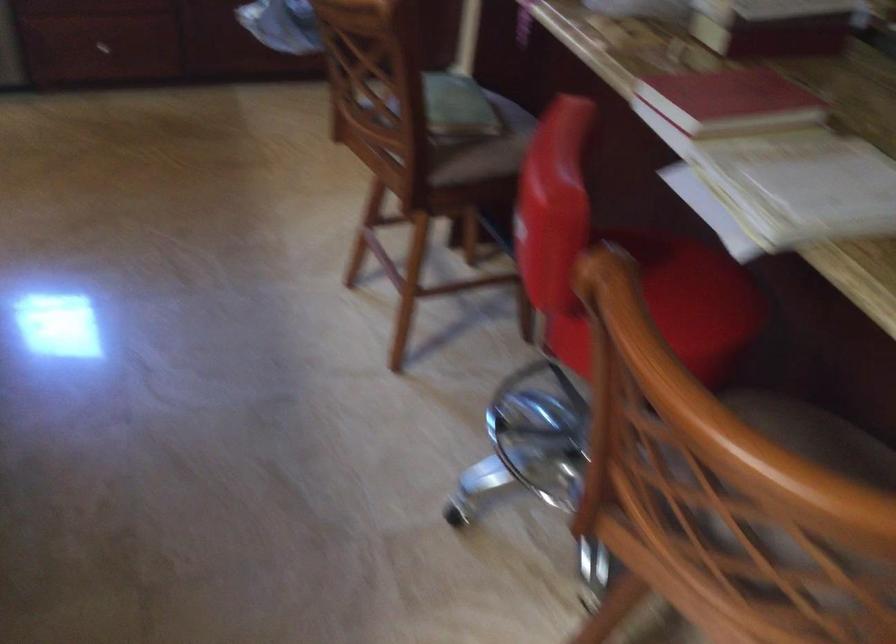
What do you see at coordinates (821, 437) in the screenshot?
I see `the wooden chair sitting surface` at bounding box center [821, 437].